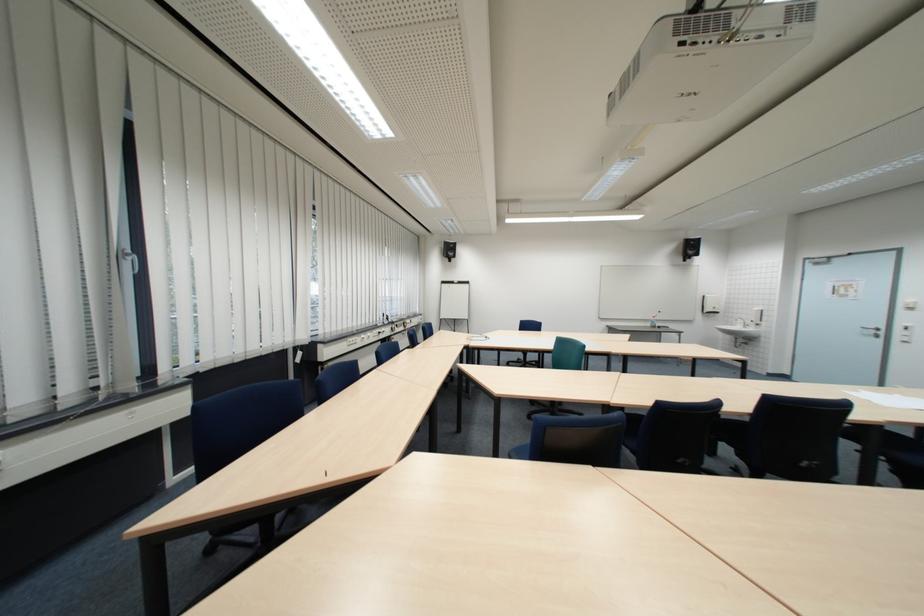
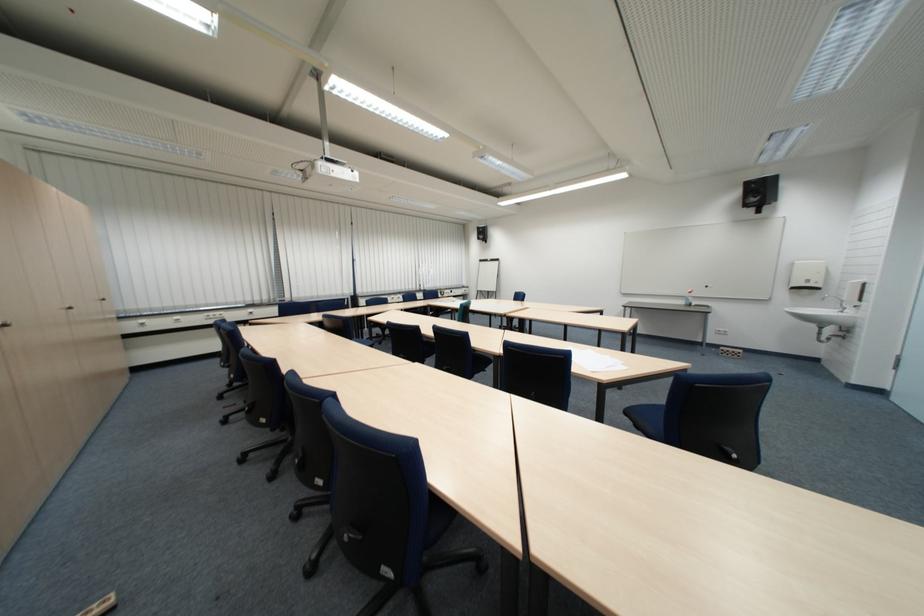
Where in the second image is the point corresponding to the point at 768,318 from the first image?

(860, 296)